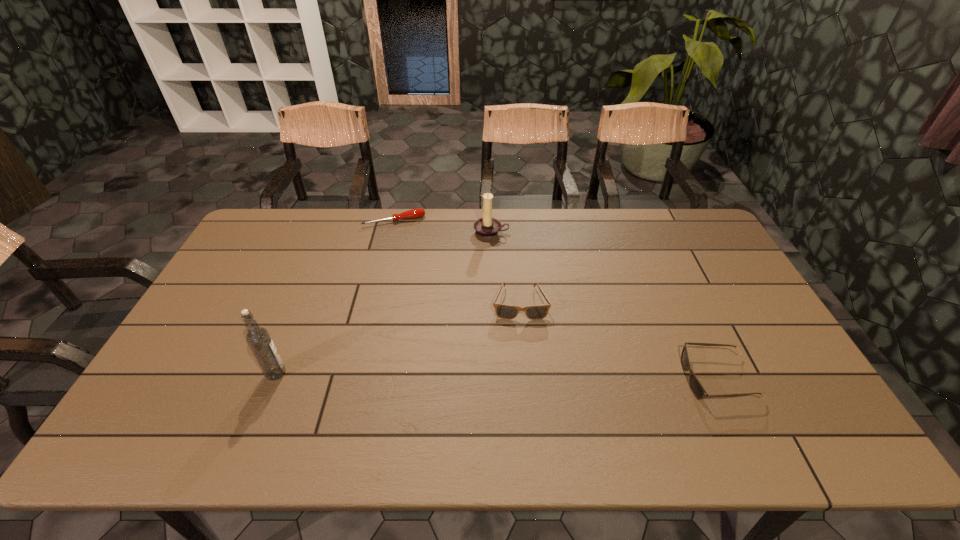
Identify the location of vodka. Image resolution: width=960 pixels, height=540 pixels. (258, 339).

Identify the location of the leftmost object. coord(258,339).

Locate an element on the screen. This screenshot has height=540, width=960. the nearer sunglasses is located at coordinates coord(699,392).

You are a GUI agent. You are given a task and a screenshot of the screen. Output one action in this format:
    pyautogui.click(x=<x>, y=<y>)
    Task: Click on the right sunglasses
    The width and height of the screenshot is (960, 540).
    Given the screenshot: What is the action you would take?
    coord(699,392)

Find the location of a particular element. The image size is (960, 540). screwdriver is located at coordinates (414, 213).

I want to click on the shortest object, so click(414, 213).

The width and height of the screenshot is (960, 540). What are the coordinates of `candle holder` in the screenshot? It's located at (487, 227).

Where is `the third nearest object`? the third nearest object is located at coordinates (537, 312).

Locate an element on the screen. The width and height of the screenshot is (960, 540). the left sunglasses is located at coordinates (537, 312).

Locate an element on the screen. Image resolution: width=960 pixels, height=540 pixels. free space located on the label of the tallest object is located at coordinates (395, 373).